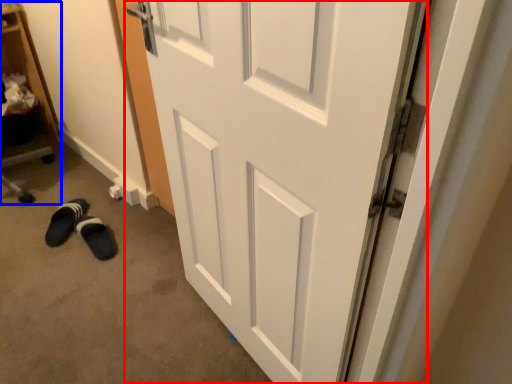
Question: Which object appears farthest to the camera in this image, door (highlighted by a red box) or bookshelf (highlighted by a blue box)?

Choices:
 (A) door
 (B) bookshelf

Answer: (B)